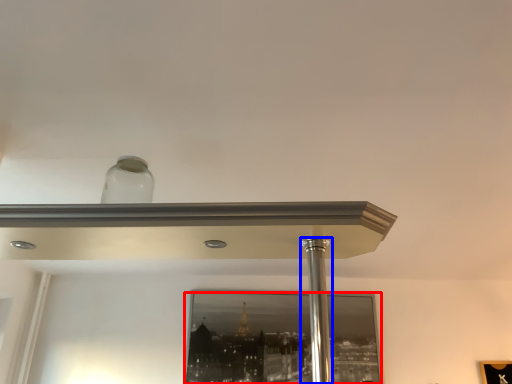
Question: Which object is further to the camera taking this photo, mirror (highlighted by a red box) or pillar (highlighted by a blue box)?

Choices:
 (A) mirror
 (B) pillar

Answer: (A)